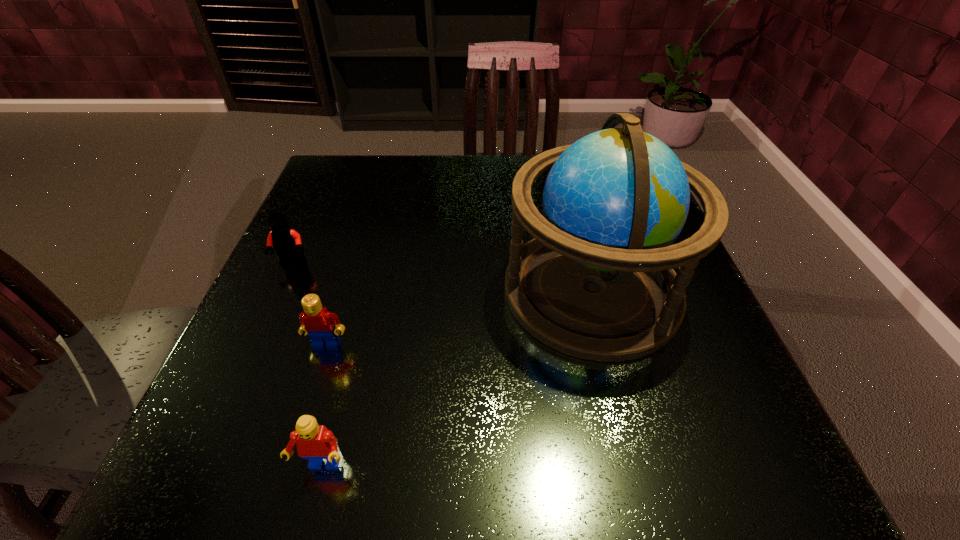
Find the location of a particular element. globe is located at coordinates (597, 282).

Locate an element on the screen. Image resolution: width=960 pixels, height=540 pixels. the rightmost object is located at coordinates (597, 282).

Where is `the leftmost object`? The image size is (960, 540). the leftmost object is located at coordinates (287, 243).

Locate an element on the screen. the leftmost Lego is located at coordinates (287, 243).

Where is `the second farthest Lego`? Image resolution: width=960 pixels, height=540 pixels. the second farthest Lego is located at coordinates (316, 321).

Find the location of a particular element. the nearest Lego is located at coordinates (315, 442).

Where is `free location located 0.250m on the back of the rightmost object`? The image size is (960, 540). free location located 0.250m on the back of the rightmost object is located at coordinates (562, 173).

The width and height of the screenshot is (960, 540). Identify the location of vacant space located on the front-facing side of the farthest Lego. (259, 339).

Where is `vacant space located on the front-facing side of the second farthest Lego`? The height and width of the screenshot is (540, 960). vacant space located on the front-facing side of the second farthest Lego is located at coordinates [x=309, y=402].

The image size is (960, 540). I want to click on object that is at the near edge, so click(x=315, y=442).